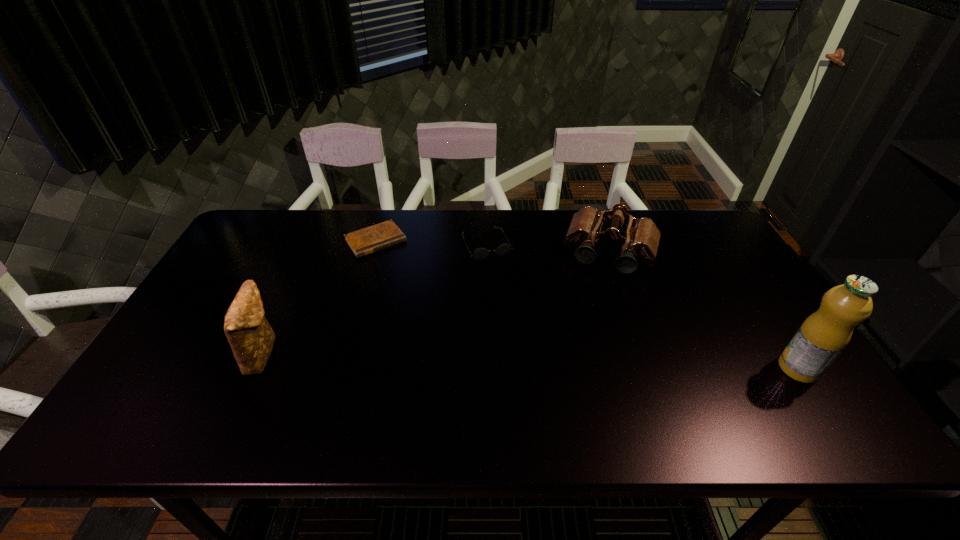
Where is `vacant space that's between the diary and the tallest object`? vacant space that's between the diary and the tallest object is located at coordinates (587, 305).

I want to click on free area in between the fruit juice and the shortest object, so click(x=587, y=305).

You are a GUI agent. You are given a task and a screenshot of the screen. Output one action in this format:
    pyautogui.click(x=<x>, y=<y>)
    Task: Click on the free area in between the second object from left to right and the sunglasses
    
    Given the screenshot: What is the action you would take?
    pyautogui.click(x=431, y=242)

The image size is (960, 540). I want to click on the third closest object relative to the rightmost object, so click(362, 242).

You are a GUI agent. You are given a task and a screenshot of the screen. Output one action in this format:
    pyautogui.click(x=<x>, y=<y>)
    Task: Click on the object that is the third closest to the third tallest object
    
    Given the screenshot: What is the action you would take?
    pyautogui.click(x=362, y=242)

At what (x,y) coordinates should I click in order to perform the action: click on free space that satisfies the following two spatial constraints: 1. on the front side of the tallest object; 2. on the front label of the sunglasses. Please return your answer as a coordinate pair (x, y). The image size is (960, 540). Looking at the image, I should click on [x=490, y=368].